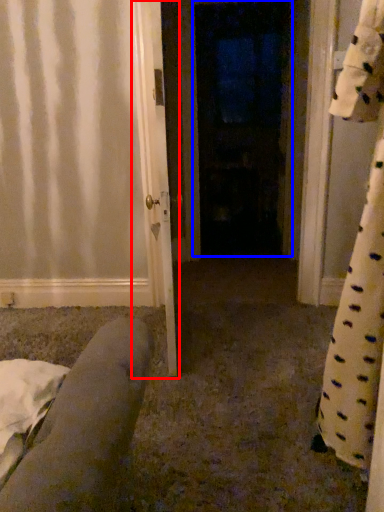
Question: Which object appears farthest to the camera in this image, door (highlighted by a red box) or door (highlighted by a blue box)?

Choices:
 (A) door
 (B) door

Answer: (B)